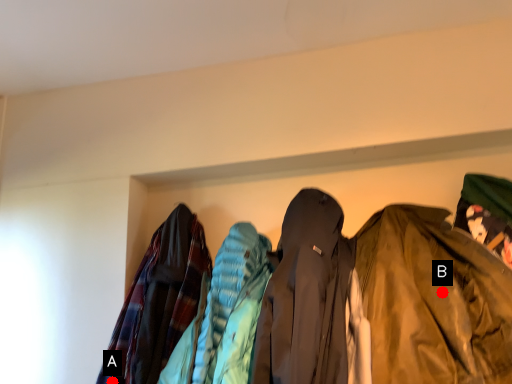
Question: Two points are circled on the image, labeled by A and B beside each circle. Which point is farther from the camera taking this photo?

Choices:
 (A) A is further
 (B) B is further

Answer: (A)